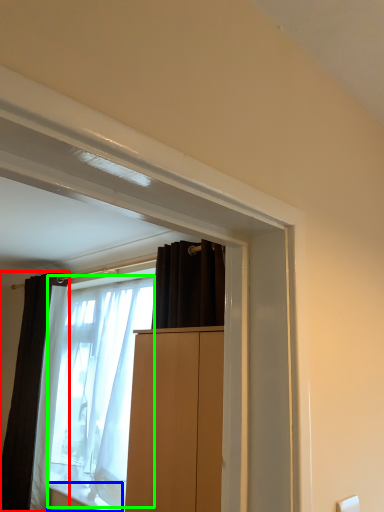
Question: Based on their relative distances, which object is nearer to curtain (highlighted by a red box)? Choose from window sill (highlighted by a blue box) and shower curtain (highlighted by a green box).

Choices:
 (A) window sill
 (B) shower curtain

Answer: (B)